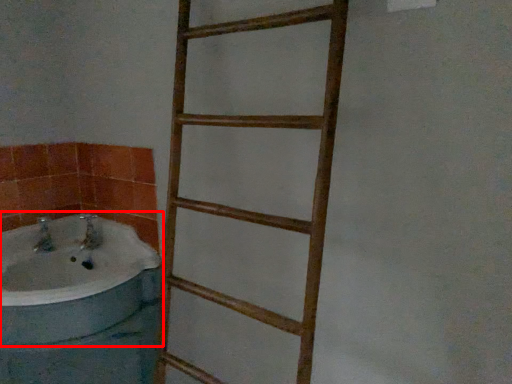
Question: In this image, where is bathtub (annotated by the red box) located relative to ladder?

Choices:
 (A) left
 (B) right

Answer: (A)